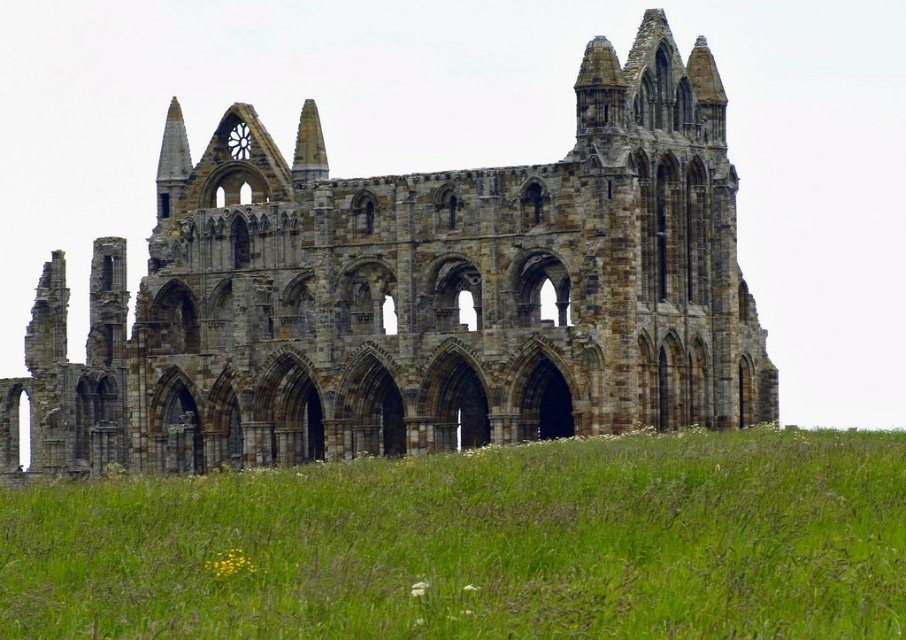
You are a drone operator tasked with capturing aerial footage of the brown stone ruins at center and the green grass at lower center. Your drone has a camera with a 10 meter range. Can you take a photo of both objects at the same time without moving the drone?

The brown stone ruins at center is 18.09 meters from green grass at lower center. Since the drone camera has a 10 meter range, it cannot capture both objects in a single photo without moving the drone.

You are standing in the field looking at the brown stone ruins at center and the green grass at lower center. Which object is taller?

The brown stone ruins at center is taller than the green grass at lower center.

You are a photographer planning to capture the brown stone ruins at center and the green grass at lower center in a single shot. Which object should you focus on first if you want both to be in clear view, considering their sizes?

The brown stone ruins at center is bigger than the green grass at lower center, so you should focus on the brown stone ruins at center first to ensure both are in clear view.